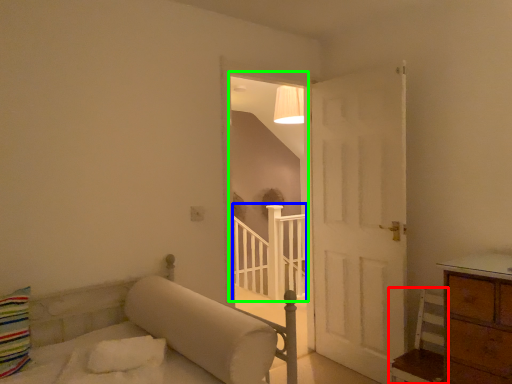
Question: Which object is positioned closest to furniture (highlighted by a red box)? Select from balustrade (highlighted by a blue box) and window (highlighted by a green box).

Choices:
 (A) balustrade
 (B) window

Answer: (A)